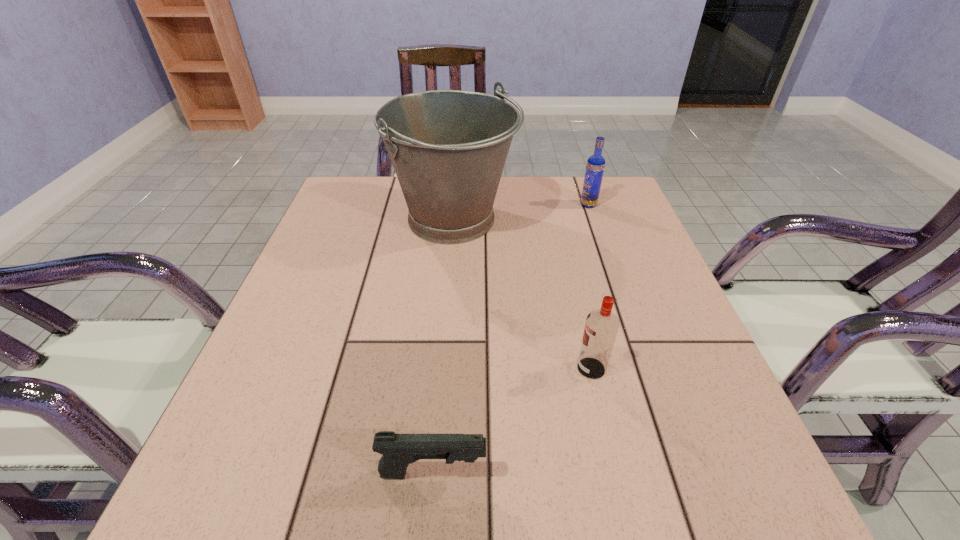
You are a GUI agent. You are given a task and a screenshot of the screen. Output one action in this format:
    pyautogui.click(x=<x>, y=<y>)
    Task: Click on the vacant area that lies between the left vodka and the right vodka
    This screenshot has height=540, width=960.
    Given the screenshot: What is the action you would take?
    pyautogui.click(x=589, y=287)

Identify the location of free space between the tallest object and the nearest object. (444, 346).

Locate an element on the screen. vacant space that is in between the nearest object and the bucket is located at coordinates (444, 346).

What are the coordinates of `vacant point located between the right vodka and the shortest object` in the screenshot? It's located at (511, 339).

Where is `object identified as the third closest to the pistol`? Image resolution: width=960 pixels, height=540 pixels. object identified as the third closest to the pistol is located at coordinates (595, 166).

Point out which object is positioned as the second nearest to the nearest object. Please provide its 2D coordinates. Your answer should be formatted as a tuple, i.e. [(x, y)], where the tuple contains the x and y coordinates of a point satisfying the conditions above.

[(448, 148)]

Locate an element on the screen. vacant space that satisfies the following two spatial constraints: 1. on the front side of the rightmost object; 2. on the front label of the nearer vodka is located at coordinates (645, 368).